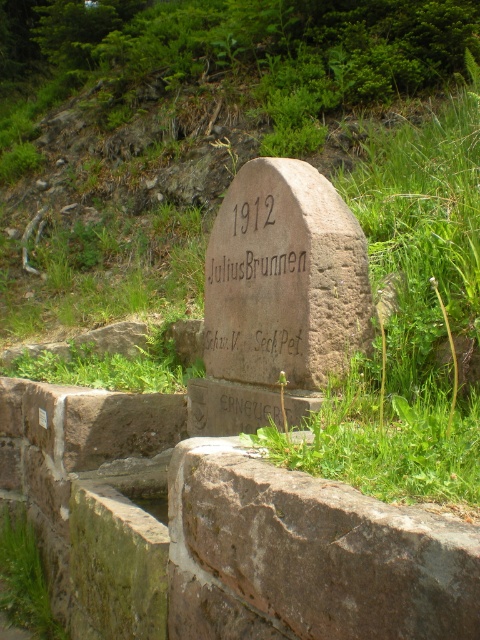
You are a landscape architect designing a garden around the monument. You need to place a new decorative element between the brown rough stone at center and the brown stone gravestone at center. Which object should the new element be placed closer to in order to maintain visual balance, considering their heights?

The new decorative element should be placed closer to the brown stone gravestone at center because it is taller than the brown rough stone at center, helping to balance the composition.